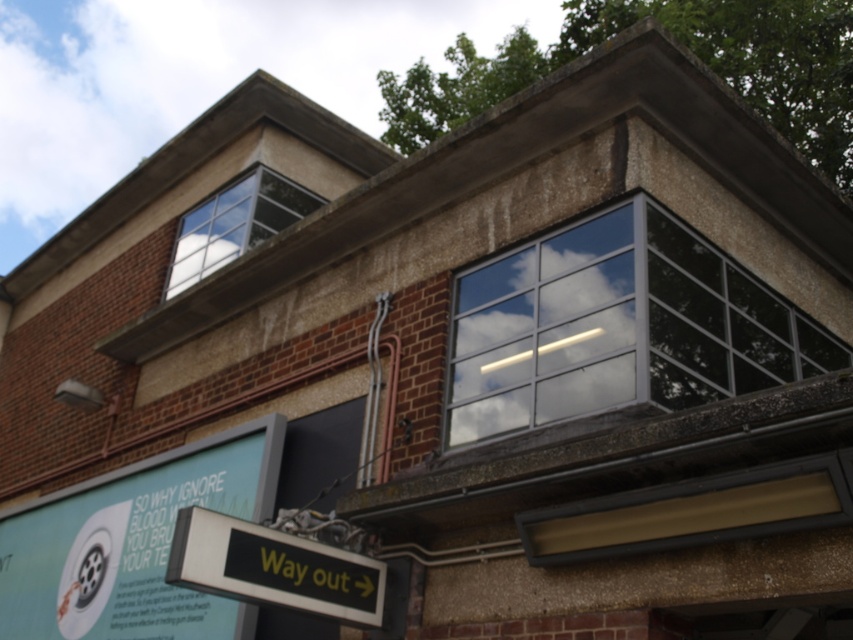
Is clear glass window at upper right bigger than clear glass window at upper left?

Yes, clear glass window at upper right is bigger than clear glass window at upper left.

Is point (541, 385) farther from viewer compared to point (268, 179)?

No, it is not.

Where is `clear glass window at upper right`? Image resolution: width=853 pixels, height=640 pixels. clear glass window at upper right is located at coordinates (618, 326).

Looking at this image, does green matte signboard at lower left have a lesser width compared to clear glass window at upper left?

Incorrect, green matte signboard at lower left's width is not less than clear glass window at upper left's.

Is point (234, 611) more distant than point (215, 205)?

No, it is in front of (215, 205).

This screenshot has height=640, width=853. Identify the location of green matte signboard at lower left. (132, 544).

Is green matte signboard at lower left in front of green plastic sign at center?

That is False.

Between green matte signboard at lower left and green plastic sign at center, which one appears on the right side from the viewer's perspective?

Positioned to the right is green plastic sign at center.

Where is `green matte signboard at lower left`? This screenshot has height=640, width=853. green matte signboard at lower left is located at coordinates (132, 544).